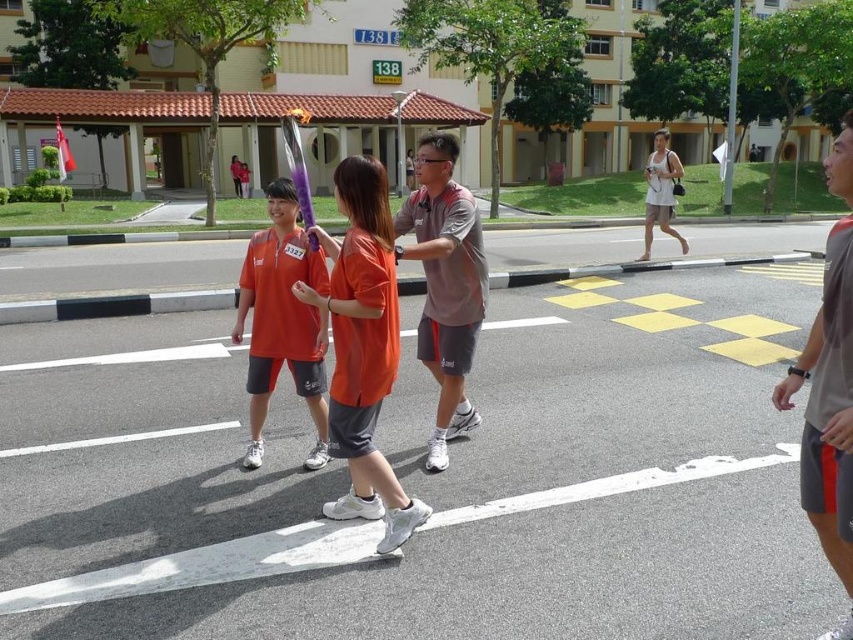
Can you confirm if gray matte shirt at center is positioned to the left of matte orange shirt at center?

Incorrect, gray matte shirt at center is not on the left side of matte orange shirt at center.

Does gray matte shirt at center have a greater height compared to matte orange shirt at center?

Yes, gray matte shirt at center is taller than matte orange shirt at center.

The width and height of the screenshot is (853, 640). I want to click on gray matte shirt at center, so click(445, 284).

Is point (828, 435) less distant than point (273, 198)?

Yes, it is.

Is gray fabric shorts at right thinner than matte orange shirt at center?

No.

This screenshot has width=853, height=640. I want to click on gray fabric shorts at right, so click(x=828, y=413).

Find the location of `gray fabric shorts at right`. gray fabric shorts at right is located at coordinates (828, 413).

The image size is (853, 640). What do you see at coordinates (828, 413) in the screenshot?
I see `gray fabric shorts at right` at bounding box center [828, 413].

This screenshot has height=640, width=853. Identify the location of gray fabric shorts at right. (828, 413).